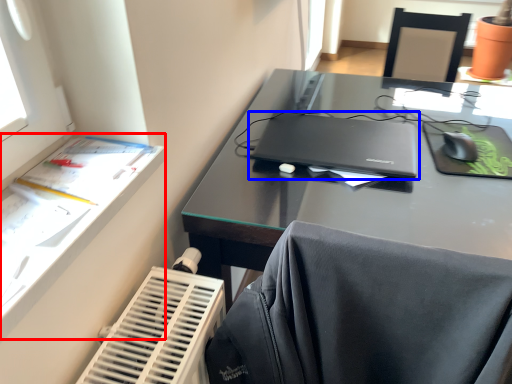
Question: Which object is closer to the camera taking this photo, writing desk (highlighted by a red box) or laptop (highlighted by a blue box)?

Choices:
 (A) writing desk
 (B) laptop

Answer: (A)